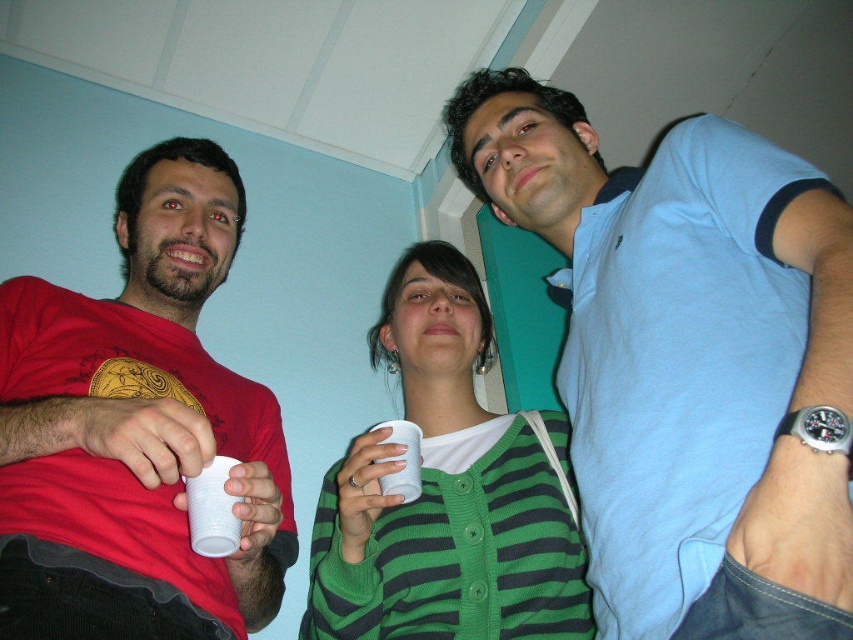
Is light blue cotton shirt at upper right above white plastic cup at center?

Yes, light blue cotton shirt at upper right is above white plastic cup at center.

Is point (763, 289) closer to camera compared to point (387, 436)?

Yes, point (763, 289) is closer to viewer.

Describe the element at coordinates (688, 358) in the screenshot. This screenshot has width=853, height=640. I see `light blue cotton shirt at upper right` at that location.

The height and width of the screenshot is (640, 853). In order to click on light blue cotton shirt at upper right in this screenshot , I will do tap(688, 358).

How distant is light blue cotton shirt at upper right from white plastic cup at lower left?

They are 18.93 inches apart.

Can you confirm if light blue cotton shirt at upper right is positioned below white plastic cup at lower left?

No.

This screenshot has height=640, width=853. What do you see at coordinates (688, 358) in the screenshot?
I see `light blue cotton shirt at upper right` at bounding box center [688, 358].

This screenshot has width=853, height=640. What are the coordinates of `light blue cotton shirt at upper right` in the screenshot? It's located at (688, 358).

Who is positioned more to the left, matte red t-shirt at left or white plastic cup at lower left?

matte red t-shirt at left

Is point (82, 612) more distant than point (196, 504)?

No, (82, 612) is closer to viewer.

Is point (96, 580) behind point (213, 545)?

Yes, point (96, 580) is behind point (213, 545).

Locate an element on the screen. Image resolution: width=853 pixels, height=640 pixels. matte red t-shirt at left is located at coordinates (137, 429).